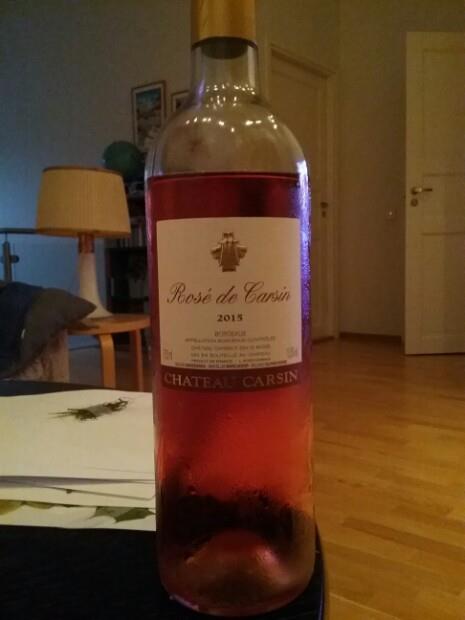
In order to click on tan lampshade in this screenshot , I will do `click(85, 222)`, `click(44, 172)`, `click(116, 177)`.